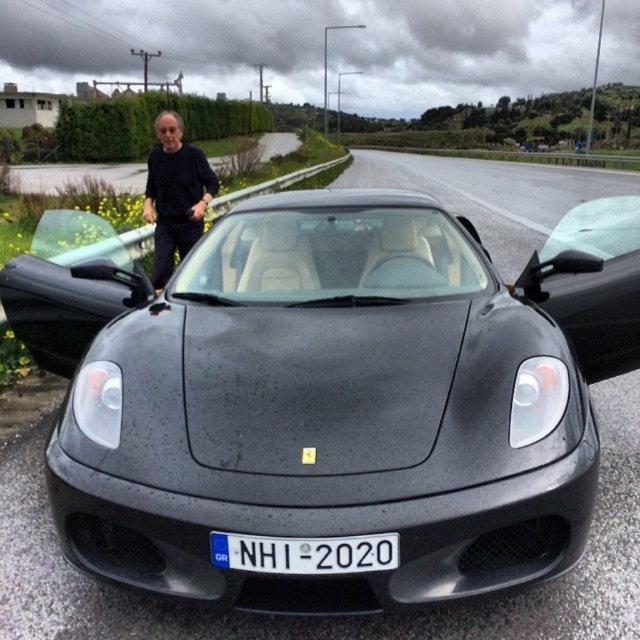
Does black matte shirt at left come in front of white plastic license plate at center?

That is False.

You are a GUI agent. You are given a task and a screenshot of the screen. Output one action in this format:
    pyautogui.click(x=<x>, y=<y>)
    Task: Click on the black matte shirt at left
    The width and height of the screenshot is (640, 640).
    Given the screenshot: What is the action you would take?
    pyautogui.click(x=173, y=195)

Between point (170, 144) and point (321, 540), which one is positioned in front?

Point (321, 540) is in front.

Where is `black matte shirt at left`? The image size is (640, 640). black matte shirt at left is located at coordinates (173, 195).

The height and width of the screenshot is (640, 640). What do you see at coordinates (332, 396) in the screenshot?
I see `glossy black sports car at center` at bounding box center [332, 396].

Does glossy black sports car at center have a lesser width compared to white plastic license plate at center?

Correct, glossy black sports car at center's width is less than white plastic license plate at center's.

Locate an element on the screen. glossy black sports car at center is located at coordinates (332, 396).

Can you confirm if glossy black sports car at center is wider than black matte shirt at left?

In fact, glossy black sports car at center might be narrower than black matte shirt at left.

Does point (54, 484) lie behind point (172, 237)?

No, (54, 484) is in front of (172, 237).

The image size is (640, 640). In order to click on glossy black sports car at center in this screenshot , I will do `click(332, 396)`.